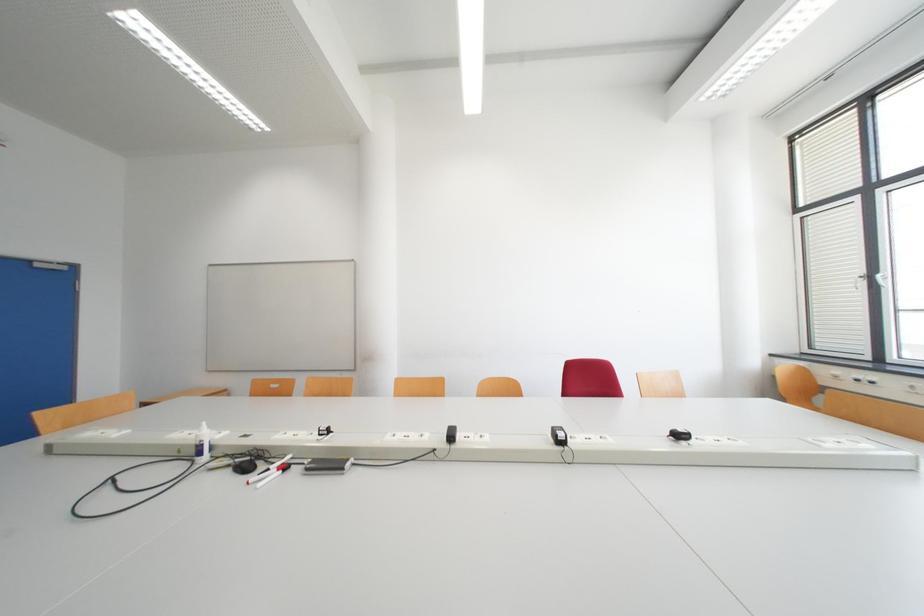
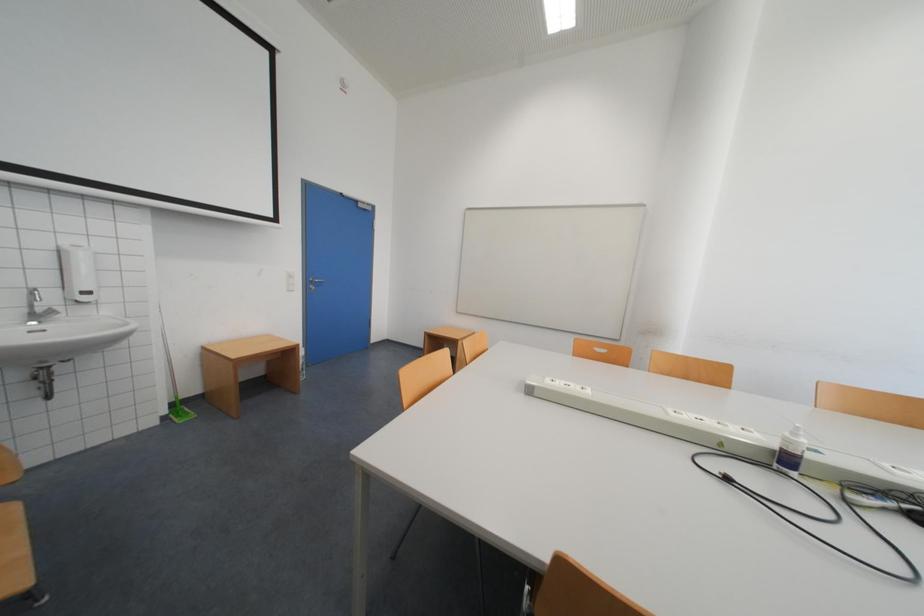
Question: In a continuous first-person perspective shot, in which direction is the camera moving?

Choices:
 (A) Left
 (B) Right
 (C) Forward
 (D) Backward

Answer: (A)